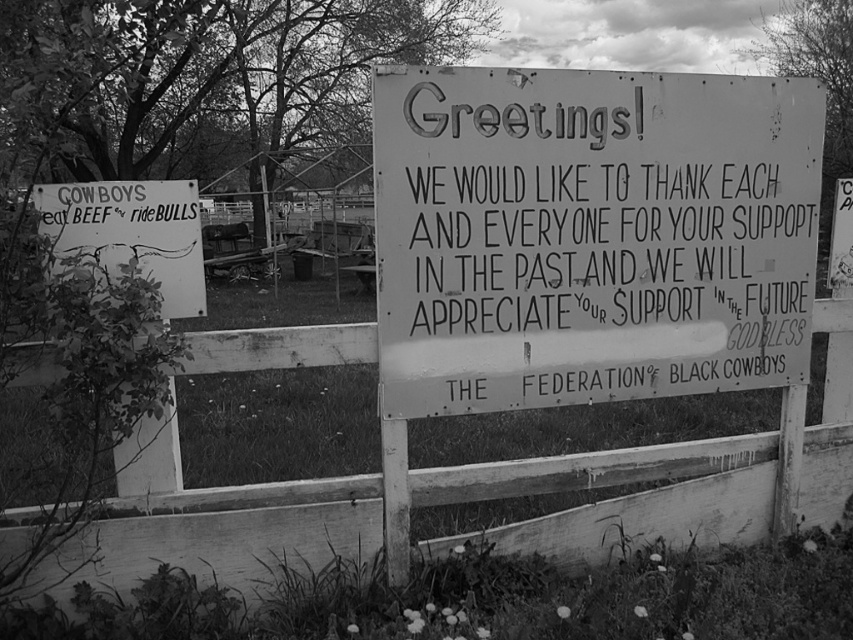
Question: Estimate the real-world distances between objects in this image. Which object is farther from the white paper sign at center?

Choices:
 (A) rusty metal signboard at left
 (B) white wooden fence at center

Answer: (A)

Question: Which point appears farthest from the camera in this image?

Choices:
 (A) (165, 220)
 (B) (379, 540)
 (C) (665, 310)

Answer: (C)

Question: Is the position of white paper sign at center more distant than that of white wooden fence at center?

Choices:
 (A) no
 (B) yes

Answer: (A)

Question: Can you confirm if white wooden fence at center is smaller than rusty metal signboard at left?

Choices:
 (A) yes
 (B) no

Answer: (B)

Question: Can you confirm if white paper sign at center is positioned above white wooden fence at center?

Choices:
 (A) yes
 (B) no

Answer: (A)

Question: Which is nearer to the white wooden fence at center?

Choices:
 (A) rusty metal signboard at left
 (B) white paper sign at center

Answer: (B)